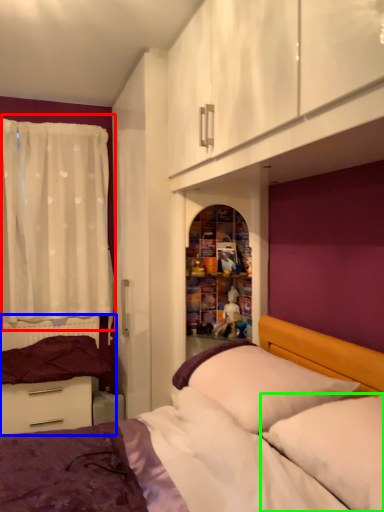
Question: Which object is the closest to the curtain (highlighted by a red box)? Choose among these: bed frame (highlighted by a blue box) or pillow (highlighted by a green box).

Choices:
 (A) bed frame
 (B) pillow

Answer: (A)